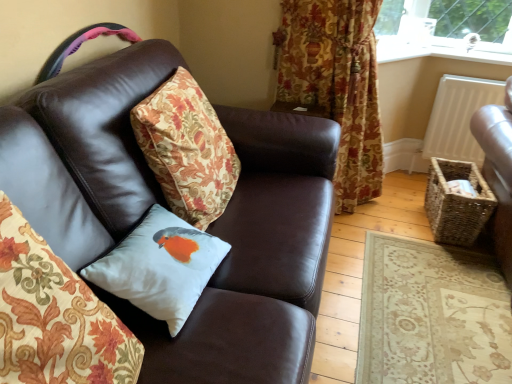
Describe the element at coordinates (336, 84) in the screenshot. I see `floral fabric curtain at upper right` at that location.

The image size is (512, 384). I want to click on white satin cushion with bird at center, acting as the first pillow starting from the back, so click(160, 267).

What do you see at coordinates (459, 117) in the screenshot? I see `white matte radiator at upper right` at bounding box center [459, 117].

The width and height of the screenshot is (512, 384). In order to click on brown leather couch at center in this screenshot , I will do `click(255, 262)`.

Is brown leather couch at center located within floral fabric curtain at upper right?

No, brown leather couch at center is located outside of floral fabric curtain at upper right.

Find the location of a particular element. studio couch that appears in front of the floral fabric curtain at upper right is located at coordinates (255, 262).

Is floral fabric curtain at upper right wider than brown leather couch at center?

Incorrect, the width of floral fabric curtain at upper right does not surpass that of brown leather couch at center.

Is brown leather couch at center looking in the opposite direction of floral fabric curtain at upper right?

brown leather couch at center is not turned away from floral fabric curtain at upper right.

Based on the photo, is brown leather couch at center taller or shorter than floral fabric curtain at upper right?

Considering their sizes, brown leather couch at center has less height than floral fabric curtain at upper right.

Can you confirm if brown leather couch at center is positioned to the right of floral fabric curtain at upper right?

In fact, brown leather couch at center is to the left of floral fabric curtain at upper right.

Is brown leather couch at center positioned beyond the bounds of floral fabric curtain at upper right?

Yes.

Who is shorter, white satin cushion with bird at center, acting as the first pillow starting from the back, or white matte radiator at upper right?

With less height is white satin cushion with bird at center, acting as the first pillow starting from the back.

Can you confirm if white satin cushion with bird at center, placed as the 2th pillow when sorted from front to back, is positioned to the right of white matte radiator at upper right?

In fact, white satin cushion with bird at center, placed as the 2th pillow when sorted from front to back, is to the left of white matte radiator at upper right.

Based on the photo, from the image's perspective, is white satin cushion with bird at center, placed as the 2th pillow when sorted from front to back, above white matte radiator at upper right?

No, from the image's perspective, white satin cushion with bird at center, placed as the 2th pillow when sorted from front to back, is not above white matte radiator at upper right.

Is white satin cushion with bird at center, acting as the first pillow starting from the back, wider or thinner than white matte radiator at upper right?

Clearly, white satin cushion with bird at center, acting as the first pillow starting from the back, has more width compared to white matte radiator at upper right.

Is white matte radiator at upper right smaller than white satin cushion at center, which is the 1th pillow in front-to-back order?

Answer: Correct, white matte radiator at upper right occupies less space than white satin cushion at center, which is the 1th pillow in front-to-back order.

Considering the sizes of objects white matte radiator at upper right and white satin cushion at center, placed as the second pillow when sorted from back to front, in the image provided, who is shorter, white matte radiator at upper right or white satin cushion at center, placed as the second pillow when sorted from back to front,?

With less height is white satin cushion at center, placed as the second pillow when sorted from back to front.

From the image's perspective, is white matte radiator at upper right above white satin cushion at center, placed as the second pillow when sorted from back to front?

Yes, from the image's perspective, white matte radiator at upper right is above white satin cushion at center, placed as the second pillow when sorted from back to front.

Is white matte radiator at upper right completely or partially outside of white satin cushion at center, which is the 1th pillow in front-to-back order?

Absolutely, white matte radiator at upper right is external to white satin cushion at center, which is the 1th pillow in front-to-back order.

Considering the relative positions of brown leather couch at center and white matte radiator at upper right in the image provided, is brown leather couch at center in front of white matte radiator at upper right?

That is True.

Considering the sizes of objects brown leather couch at center and white matte radiator at upper right in the image provided, who is smaller, brown leather couch at center or white matte radiator at upper right?

Smaller between the two is white matte radiator at upper right.

Which is more to the right, brown leather couch at center or white matte radiator at upper right?

From the viewer's perspective, white matte radiator at upper right appears more on the right side.

Is there a large distance between brown leather couch at center and white matte radiator at upper right?

Yes, brown leather couch at center is far from white matte radiator at upper right.

Choose the correct answer: Is white matte radiator at upper right inside white satin cushion with bird at center, placed as the 2th pillow when sorted from front to back, or outside it?

white matte radiator at upper right is outside white satin cushion with bird at center, placed as the 2th pillow when sorted from front to back.

Considering their positions, is white matte radiator at upper right located in front of or behind white satin cushion with bird at center, acting as the first pillow starting from the back?

white matte radiator at upper right is positioned farther from the viewer than white satin cushion with bird at center, acting as the first pillow starting from the back.

From the white matte radiator at upper right, count 1st pillows forward and point to it. Please provide its 2D coordinates.

[(160, 267)]

Which is less distant, (448,145) or (286,2)?

The point (286,2) is more forward.

Consider the image. In the image, is white matte radiator at upper right positioned in front of or behind floral fabric curtain at upper right?

In the image, white matte radiator at upper right appears behind floral fabric curtain at upper right.

Is white matte radiator at upper right facing towards floral fabric curtain at upper right?

No, white matte radiator at upper right is not oriented towards floral fabric curtain at upper right.

In the image, there is a floral fabric curtain at upper right. Where is `studio couch below it (from a real-world perspective)`? This screenshot has height=384, width=512. studio couch below it (from a real-world perspective) is located at coordinates (255, 262).

In order to click on curtain above the brown leather couch at center (from the image's perspective) in this screenshot , I will do `click(336, 84)`.

From the image, which object appears to be farther from brown leather couch at center, white satin cushion with bird at center, placed as the 2th pillow when sorted from front to back, or white satin cushion at center, placed as the second pillow when sorted from back to front?

white satin cushion at center, placed as the second pillow when sorted from back to front, lies further to brown leather couch at center than the other object.

From the image, which object appears to be nearer to white matte radiator at upper right, white satin cushion at center, which is the 1th pillow in front-to-back order, or white satin cushion with bird at center, placed as the 2th pillow when sorted from front to back?

white satin cushion with bird at center, placed as the 2th pillow when sorted from front to back, is closer to white matte radiator at upper right.

Consider the image. Looking at the image, which one is located closer to brown leather couch at center, white satin cushion at center, placed as the second pillow when sorted from back to front, or floral fabric curtain at upper right?

white satin cushion at center, placed as the second pillow when sorted from back to front, is closer to brown leather couch at center.

Looking at the image, which one is located further to white satin cushion at center, placed as the second pillow when sorted from back to front, floral fabric curtain at upper right or brown leather couch at center?

Based on the image, floral fabric curtain at upper right appears to be further to white satin cushion at center, placed as the second pillow when sorted from back to front.

From the image, which object appears to be farther from brown leather couch at center, white matte radiator at upper right or white satin cushion at center, which is the 1th pillow in front-to-back order?

white matte radiator at upper right is positioned further to the anchor brown leather couch at center.

From the image, which object appears to be farther from white matte radiator at upper right, white satin cushion with bird at center, acting as the first pillow starting from the back, or floral fabric curtain at upper right?

white satin cushion with bird at center, acting as the first pillow starting from the back, lies further to white matte radiator at upper right than the other object.

In the scene shown: Considering their positions, is brown leather couch at center positioned closer to white satin cushion at center, which is the 1th pillow in front-to-back order, than floral fabric curtain at upper right?

brown leather couch at center is closer to white satin cushion at center, which is the 1th pillow in front-to-back order.

Looking at the image, which one is located further to white satin cushion at center, which is the 1th pillow in front-to-back order, floral fabric curtain at upper right or white matte radiator at upper right?

Based on the image, white matte radiator at upper right appears to be further to white satin cushion at center, which is the 1th pillow in front-to-back order.

In order to click on pillow positioned between white satin cushion at center, placed as the second pillow when sorted from back to front, and floral fabric curtain at upper right from near to far in this screenshot , I will do `click(160, 267)`.

You are a GUI agent. You are given a task and a screenshot of the screen. Output one action in this format:
    pyautogui.click(x=<x>, y=<y>)
    Task: Click on the pillow between white satin cushion at center, placed as the second pillow when sorted from back to front, and white matte radiator at upper right from front to back
    The height and width of the screenshot is (384, 512).
    Given the screenshot: What is the action you would take?
    pyautogui.click(x=160, y=267)

Where is `pillow between brown leather couch at center and white satin cushion with bird at center, acting as the first pillow starting from the back, along the z-axis`? The image size is (512, 384). pillow between brown leather couch at center and white satin cushion with bird at center, acting as the first pillow starting from the back, along the z-axis is located at coordinates (55, 317).

Locate an element on the screen. This screenshot has width=512, height=384. curtain between brown leather couch at center and white matte radiator at upper right along the z-axis is located at coordinates (336, 84).